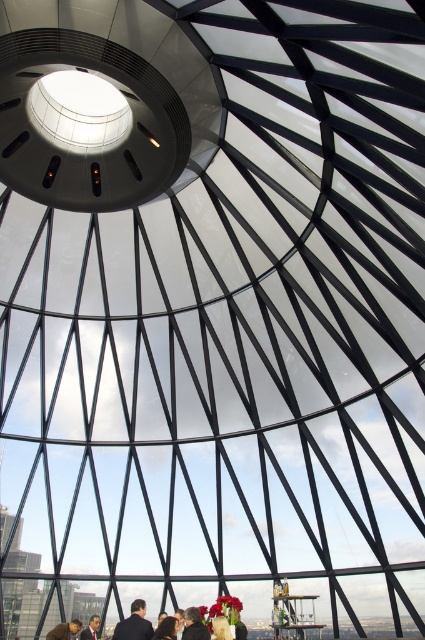
You are observing two people standing in the atrium. One has dark brown hair at lower center and the other has blonde hair at lower center. From your perspective, which person is standing closer to the ground?

The blonde hair at lower center is closer to the ground because the dark brown hair at lower center is located above it.

You are an event planner observing a modern architectural space with a glass dome skylight. You notice a dark blue suit at lower center and a blonde hair at lower center. Which object occupies more space in the scene?

The dark blue suit at lower center is bigger than blonde hair at lower center, so it occupies more space in the scene.